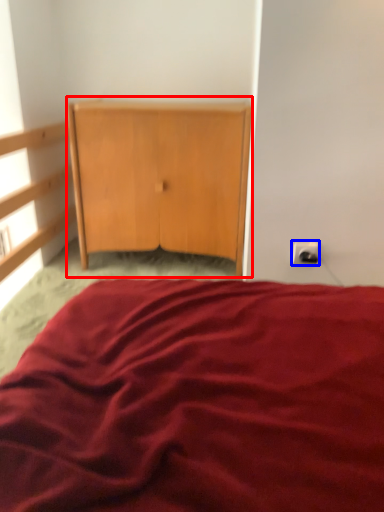
Question: Which point is further to the camera, cupboard (highlighted by a red box) or electric outlet (highlighted by a blue box)?

Choices:
 (A) cupboard
 (B) electric outlet

Answer: (A)